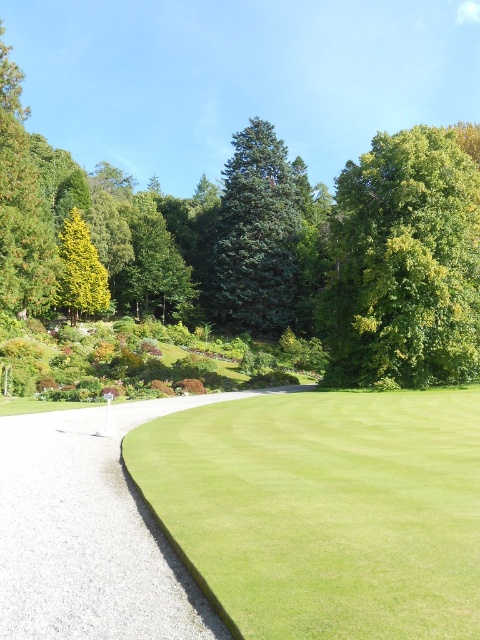
Question: Estimate the real-world distances between objects in this image. Which object is farther from the yellow-green coniferous tree at left?

Choices:
 (A) green leafy tree at upper center
 (B) green leafy tree at upper right
 (C) gravelly path at lower left
 (D) green smooth grass at center

Answer: (D)

Question: Can you confirm if green leafy tree at upper center is bigger than gravelly path at lower left?

Choices:
 (A) no
 (B) yes

Answer: (B)

Question: Is green smooth grass at center smaller than green leafy tree at upper right?

Choices:
 (A) yes
 (B) no

Answer: (A)

Question: Which object is farther from the camera taking this photo?

Choices:
 (A) gravelly path at lower left
 (B) green leafy tree at upper center

Answer: (B)

Question: Which is nearer to the green leafy tree at upper right?

Choices:
 (A) gravelly path at lower left
 (B) green needle-like at center
 (C) green smooth grass at center

Answer: (B)

Question: Can you confirm if green leafy tree at upper center is positioned below green smooth grass at center?

Choices:
 (A) no
 (B) yes

Answer: (A)